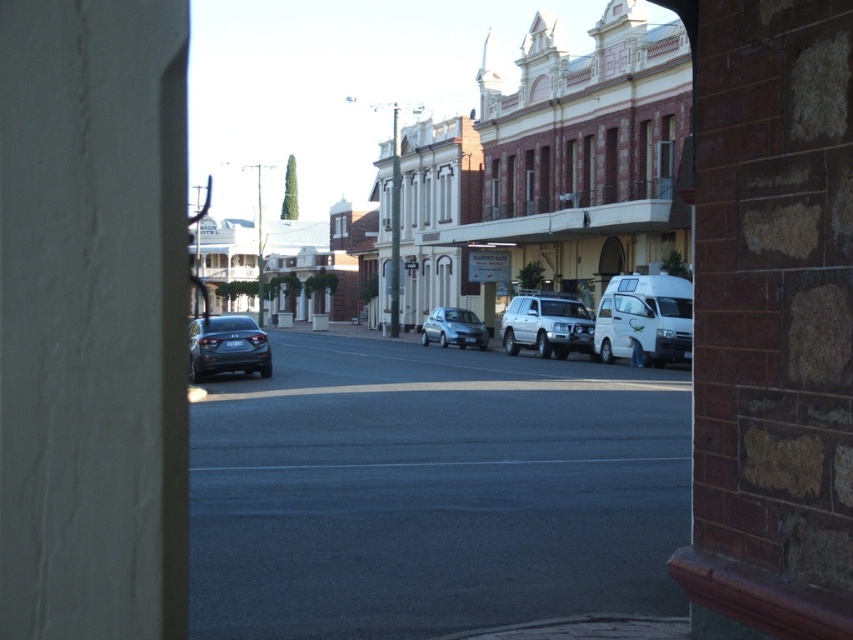
Which of these two, satin black car at center or matte white building at center, stands shorter?

satin black car at center is shorter.

Can you confirm if satin black car at center is taller than matte white building at center?

Incorrect, satin black car at center's height is not larger of matte white building at center's.

Describe the element at coordinates (431, 492) in the screenshot. I see `satin black car at center` at that location.

This screenshot has height=640, width=853. I want to click on satin black car at center, so click(431, 492).

In order to click on matte white building at center in this screenshot , I will do pyautogui.click(x=457, y=109).

Image resolution: width=853 pixels, height=640 pixels. Describe the element at coordinates (457, 109) in the screenshot. I see `matte white building at center` at that location.

Locate an element on the screen. This screenshot has height=640, width=853. matte white building at center is located at coordinates (457, 109).

Between satin black car at center and satin silver suv at center, which one is positioned higher?

Positioned higher is satin silver suv at center.

Is satin black car at center above satin silver suv at center?

Actually, satin black car at center is below satin silver suv at center.

The width and height of the screenshot is (853, 640). What do you see at coordinates (431, 492) in the screenshot? I see `satin black car at center` at bounding box center [431, 492].

Locate an element on the screen. This screenshot has height=640, width=853. satin black car at center is located at coordinates (431, 492).